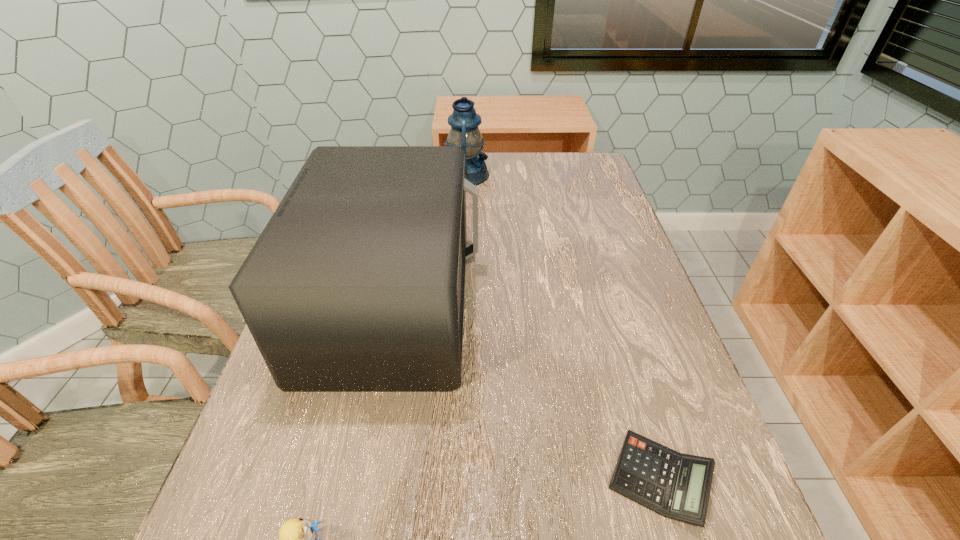
Locate which object is the third closest to the farthest object. Please provide its 2D coordinates. Your answer should be formatted as a tuple, i.e. [(x, y)], where the tuple contains the x and y coordinates of a point satisfying the conditions above.

[(296, 539)]

I want to click on vacant space that satisfies the following two spatial constraints: 1. on the back side of the rightmost object; 2. on the face of the farthest object, so click(568, 175).

Find the location of a particular element. vacant position in the image that satisfies the following two spatial constraints: 1. on the face of the farthest object; 2. on the left side of the rightmost object is located at coordinates (451, 479).

Locate an element on the screen. The width and height of the screenshot is (960, 540). vacant area that satisfies the following two spatial constraints: 1. on the front-facing side of the shortest object; 2. on the left side of the third nearest object is located at coordinates (356, 479).

Identify the location of free space in the image that satisfies the following two spatial constraints: 1. on the face of the calculator; 2. on the right side of the farthest object. (451, 479).

The height and width of the screenshot is (540, 960). I want to click on free location that satisfies the following two spatial constraints: 1. on the front-facing side of the shortest object; 2. on the left side of the microwave oven, so click(x=356, y=479).

At what (x,y) coordinates should I click in order to perform the action: click on free spot that satisfies the following two spatial constraints: 1. on the face of the rightmost object; 2. on the right side of the farthest object. Please return your answer as a coordinate pair (x, y). This screenshot has width=960, height=540. Looking at the image, I should click on (451, 479).